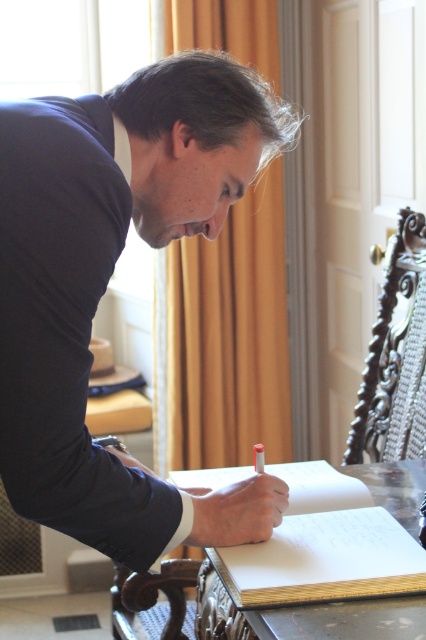
Based on the photo, does dark blue shirt at center appear over wooden table at center?

Correct, dark blue shirt at center is located above wooden table at center.

Who is positioned more to the right, dark blue shirt at center or wooden table at center?

From the viewer's perspective, wooden table at center appears more on the right side.

Is point (221, 544) behind point (411, 483)?

No.

The width and height of the screenshot is (426, 640). What are the coordinates of `dark blue shirt at center` in the screenshot? It's located at (108, 280).